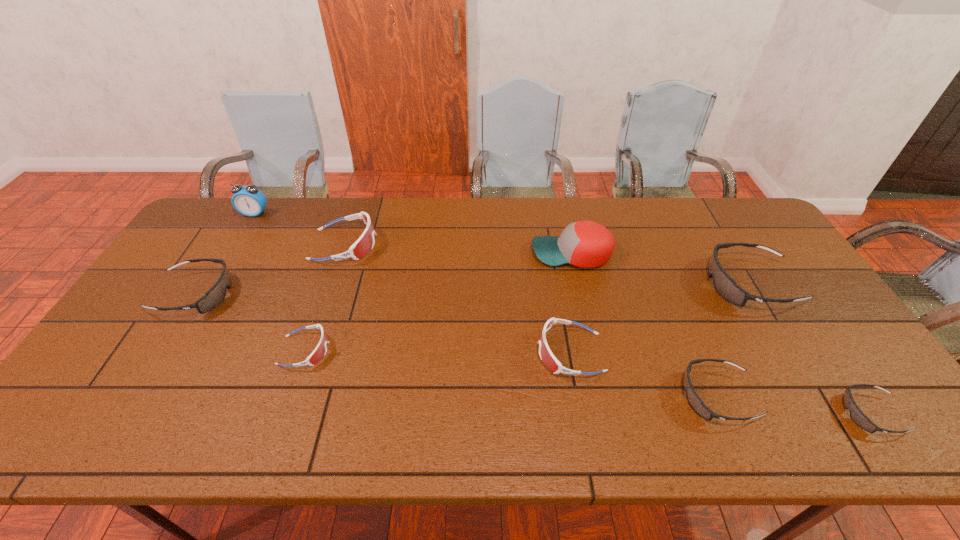
Where is `free space located on the lenses of the biggest black goggles`? free space located on the lenses of the biggest black goggles is located at coordinates (588, 285).

At what (x,y) coordinates should I click in order to perform the action: click on vacant space located on the lenses of the leftmost black goggles. Please return your answer as a coordinate pair (x, y). This screenshot has width=960, height=540. Looking at the image, I should click on (298, 294).

The height and width of the screenshot is (540, 960). I want to click on vacant space located on the front-facing side of the second biggest red goggles, so click(400, 353).

Image resolution: width=960 pixels, height=540 pixels. I want to click on vacant position located on the front-facing side of the second biggest red goggles, so click(x=475, y=353).

Where is `free location located on the front-facing side of the second biggest red goggles`? The height and width of the screenshot is (540, 960). free location located on the front-facing side of the second biggest red goggles is located at coordinates pyautogui.click(x=396, y=353).

Identify the location of vacant region located on the lenses of the third black goggles from right to left. The height and width of the screenshot is (540, 960). click(635, 396).

You are a GUI agent. You are given a task and a screenshot of the screen. Output one action in this format:
    pyautogui.click(x=<x>, y=<y>)
    Task: Click on the vacant area situated 0.360m on the lenses of the third black goggles from right to left
    This screenshot has height=540, width=960.
    Given the screenshot: What is the action you would take?
    pyautogui.click(x=529, y=396)

Locate an element on the screen. The width and height of the screenshot is (960, 540). free region located on the lenses of the third black goggles from right to left is located at coordinates (516, 396).

This screenshot has width=960, height=540. What are the coordinates of `vacant region located on the front-facing side of the smallest red goggles` in the screenshot? It's located at (403, 350).

You are a GUI agent. You are given a task and a screenshot of the screen. Output one action in this format:
    pyautogui.click(x=<x>, y=<y>)
    Task: Click on the vacant area situated on the lenses of the shortest object
    The image size is (960, 540).
    Given the screenshot: What is the action you would take?
    pyautogui.click(x=739, y=414)